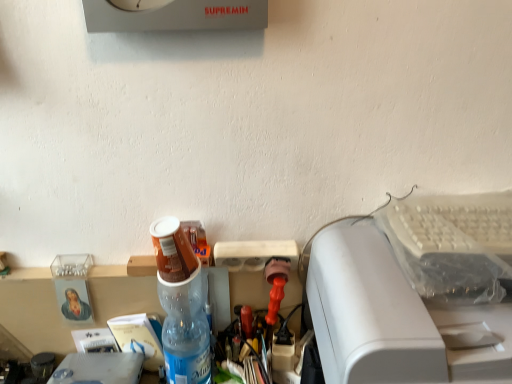
Question: Is white plastic printer at right taller or shorter than translucent plastic bottle at center?

Choices:
 (A) short
 (B) tall

Answer: (B)

Question: From the image's perspective, is white plastic printer at right above or below translucent plastic bottle at center?

Choices:
 (A) above
 (B) below

Answer: (B)

Question: Is white plastic printer at right to the left or to the right of translucent plastic bottle at center in the image?

Choices:
 (A) left
 (B) right

Answer: (B)

Question: From the image's perspective, is translucent plastic bottle at center positioned above or below white plastic printer at right?

Choices:
 (A) above
 (B) below

Answer: (A)

Question: Is translucent plastic bottle at center taller or shorter than white plastic printer at right?

Choices:
 (A) tall
 (B) short

Answer: (B)

Question: Is translucent plastic bottle at center in front of or behind white plastic printer at right in the image?

Choices:
 (A) behind
 (B) front

Answer: (A)

Question: Is translucent plastic bottle at center inside the boundaries of white plastic printer at right, or outside?

Choices:
 (A) outside
 (B) inside

Answer: (A)